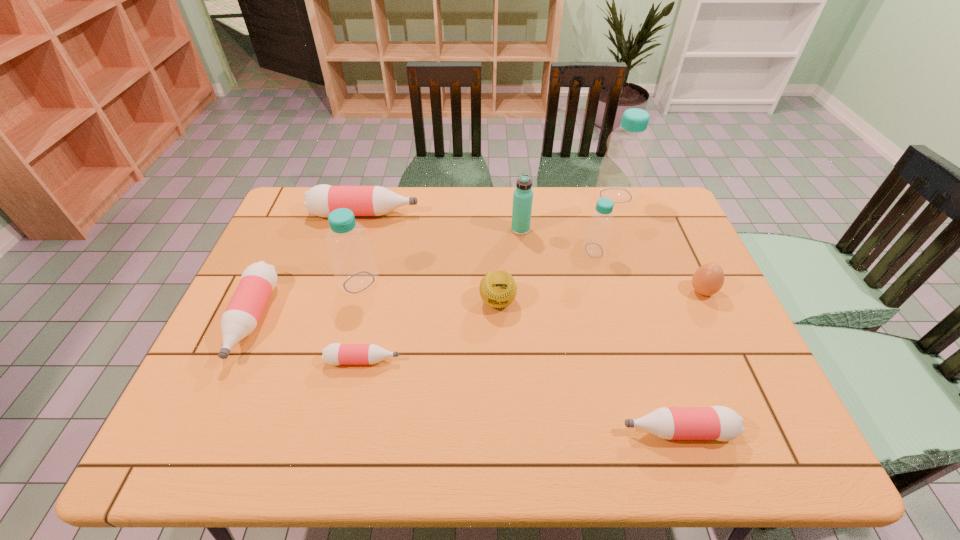
This screenshot has width=960, height=540. Identify the location of free region located with the cap open on the shortest bottle. (533, 361).

This screenshot has width=960, height=540. What are the coordinates of `thermos bottle located in the far edge section of the desktop` in the screenshot? It's located at (523, 195).

Where is `object situated at the near edge`? object situated at the near edge is located at coordinates (721, 423).

You are a GUI agent. You are given a task and a screenshot of the screen. Output one action in this format:
    pyautogui.click(x=<x>, y=<y>)
    Task: Click on the boiled egg at the right edge
    The height and width of the screenshot is (540, 960).
    Given the screenshot: What is the action you would take?
    pyautogui.click(x=708, y=279)

In order to click on object present at the far left corner in this screenshot , I will do `click(321, 200)`.

You are a GUI agent. You are given a task and a screenshot of the screen. Output one action in this format:
    pyautogui.click(x=<x>, y=<y>)
    Task: Click on the object that is at the far right corner
    The width and height of the screenshot is (960, 540).
    Given the screenshot: What is the action you would take?
    pyautogui.click(x=622, y=170)

Where is `object that is at the near right corner`? The image size is (960, 540). object that is at the near right corner is located at coordinates (721, 423).

The height and width of the screenshot is (540, 960). Identify the location of vacant region at the far edge. (564, 191).

Locate an element on the screen. The height and width of the screenshot is (540, 960). vacant space at the near edge of the desktop is located at coordinates (367, 457).

In the image, there is a desktop. Identify the location of vacant space at the left edge. This screenshot has height=540, width=960. pos(230,374).